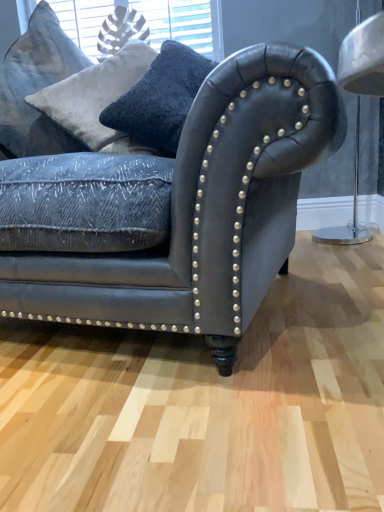
The width and height of the screenshot is (384, 512). Find the location of `velvety gray pillow at upper left`. velvety gray pillow at upper left is located at coordinates (36, 87).

What do you see at coordinates (36, 87) in the screenshot? The width and height of the screenshot is (384, 512). I see `velvety gray pillow at upper left` at bounding box center [36, 87].

Describe the element at coordinates (169, 200) in the screenshot. The image size is (384, 512). I see `matte black leather couch at center` at that location.

Where is `matte black leather couch at center`? This screenshot has height=512, width=384. matte black leather couch at center is located at coordinates (169, 200).

Measure the distance between matte black leather couch at center and camera.

The depth of matte black leather couch at center is 72.71 centimeters.

At what (x,y) coordinates should I click in order to perform the action: click on velvety gray pillow at upper left. Please return your answer as a coordinate pair (x, y). This screenshot has height=512, width=384. Looking at the image, I should click on (36, 87).

Between velvety gray pillow at upper left and matte black leather couch at center, which one appears on the left side from the viewer's perspective?

From the viewer's perspective, velvety gray pillow at upper left appears more on the left side.

Is velvety gray pillow at upper left further to camera compared to matte black leather couch at center?

Yes, it is behind matte black leather couch at center.

Is point (46, 37) behind point (337, 136)?

Yes.

From the image's perspective, is velvety gray pillow at upper left beneath matte black leather couch at center?

No.

From a real-world perspective, is velvety gray pillow at upper left beneath matte black leather couch at center?

No, from a real-world perspective, velvety gray pillow at upper left is not beneath matte black leather couch at center.

In terms of width, does velvety gray pillow at upper left look wider or thinner when compared to matte black leather couch at center?

Clearly, velvety gray pillow at upper left has less width compared to matte black leather couch at center.

In the scene shown: Which of these two, velvety gray pillow at upper left or matte black leather couch at center, stands shorter?

velvety gray pillow at upper left is shorter.

Is velvety gray pillow at upper left bigger or smaller than matte black leather couch at center?

In the image, velvety gray pillow at upper left appears to be smaller than matte black leather couch at center.

Is velvety gray pillow at upper left situated inside matte black leather couch at center or outside?

velvety gray pillow at upper left is spatially positioned inside matte black leather couch at center.

Would you say velvety gray pillow at upper left is a long distance from matte black leather couch at center?

No.

Consider the image. Is velvety gray pillow at upper left aimed at matte black leather couch at center?

No, velvety gray pillow at upper left is not oriented towards matte black leather couch at center.

In the scene shown: How different are the orientations of velvety gray pillow at upper left and matte black leather couch at center in degrees?

There is a 0.000251-degree angle between the facing directions of velvety gray pillow at upper left and matte black leather couch at center.

How much distance is there between velvety gray pillow at upper left and matte black leather couch at center?

They are 25.92 inches apart.

Identify the location of pillow above the matte black leather couch at center (from a real-world perspective). The height and width of the screenshot is (512, 384). (36, 87).

Which object is positioned more to the left, matte black leather couch at center or velvety gray pillow at upper left?

velvety gray pillow at upper left is more to the left.

Is matte black leather couch at center in front of or behind velvety gray pillow at upper left in the image?

In the image, matte black leather couch at center appears in front of velvety gray pillow at upper left.

Is point (213, 91) less distant than point (45, 147)?

Yes, it is.

From the image's perspective, who appears lower, matte black leather couch at center or velvety gray pillow at upper left?

matte black leather couch at center, from the image's perspective.

From a real-world perspective, who is located lower, matte black leather couch at center or velvety gray pillow at upper left?

matte black leather couch at center is physically lower.

In the scene shown: Considering the sizes of objects matte black leather couch at center and velvety gray pillow at upper left in the image provided, who is thinner, matte black leather couch at center or velvety gray pillow at upper left?

velvety gray pillow at upper left is thinner.

Who is taller, matte black leather couch at center or velvety gray pillow at upper left?

Standing taller between the two is matte black leather couch at center.

Does matte black leather couch at center have a smaller size compared to velvety gray pillow at upper left?

No.

Would you say velvety gray pillow at upper left is part of matte black leather couch at center's contents?

Yes, velvety gray pillow at upper left is inside matte black leather couch at center.

Consider the image. Is matte black leather couch at center not close to velvety gray pillow at upper left?

Actually, matte black leather couch at center and velvety gray pillow at upper left are a little close together.

Is matte black leather couch at center aimed at velvety gray pillow at upper left?

No, matte black leather couch at center is not turned towards velvety gray pillow at upper left.

At what (x,y) coordinates should I click in order to perform the action: click on pillow located above the matte black leather couch at center (from the image's perspective). Please return your answer as a coordinate pair (x, y). The width and height of the screenshot is (384, 512). Looking at the image, I should click on (36, 87).

Identify the location of pillow to the left of matte black leather couch at center. (36, 87).

The image size is (384, 512). In order to click on studio couch that appears below the velvety gray pillow at upper left (from the image's perspective) in this screenshot , I will do `click(169, 200)`.